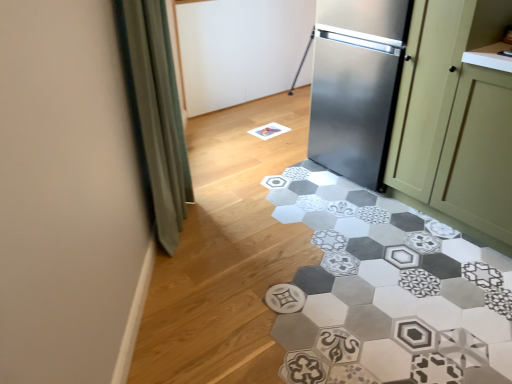
Question: Is green matte cabinet at right next to stainless steel cabinet at right?

Choices:
 (A) yes
 (B) no

Answer: (A)

Question: Can you confirm if green matte cabinet at right is smaller than stainless steel cabinet at right?

Choices:
 (A) no
 (B) yes

Answer: (B)

Question: Is green matte cabinet at right to the left of stainless steel cabinet at right from the viewer's perspective?

Choices:
 (A) yes
 (B) no

Answer: (B)

Question: Is green matte cabinet at right far from stainless steel cabinet at right?

Choices:
 (A) yes
 (B) no

Answer: (B)

Question: Is green matte cabinet at right thinner than stainless steel cabinet at right?

Choices:
 (A) yes
 (B) no

Answer: (B)

Question: From the image's perspective, is green fabric curtain at left positioned above or below green matte cabinet at right?

Choices:
 (A) above
 (B) below

Answer: (A)

Question: Considering the positions of green fabric curtain at left and green matte cabinet at right in the image, is green fabric curtain at left taller or shorter than green matte cabinet at right?

Choices:
 (A) short
 (B) tall

Answer: (B)

Question: Is point (154, 110) closer or farther from the camera than point (490, 96)?

Choices:
 (A) farther
 (B) closer

Answer: (A)

Question: In the image, is green fabric curtain at left on the left side or the right side of green matte cabinet at right?

Choices:
 (A) left
 (B) right

Answer: (A)

Question: From the image's perspective, relative to stainless steel cabinet at right, is green fabric curtain at left above or below?

Choices:
 (A) below
 (B) above

Answer: (A)

Question: Does point (175, 203) appear closer or farther from the camera than point (501, 130)?

Choices:
 (A) closer
 (B) farther

Answer: (B)

Question: Based on their sizes in the image, would you say green fabric curtain at left is bigger or smaller than stainless steel cabinet at right?

Choices:
 (A) big
 (B) small

Answer: (B)

Question: From a real-world perspective, is green fabric curtain at left above or below stainless steel cabinet at right?

Choices:
 (A) below
 (B) above

Answer: (B)

Question: From a real-world perspective, is gray hexagonal tile at center physically located above or below green matte cabinet at right?

Choices:
 (A) above
 (B) below

Answer: (B)

Question: Based on their positions, is gray hexagonal tile at center located to the left or right of green matte cabinet at right?

Choices:
 (A) right
 (B) left

Answer: (B)